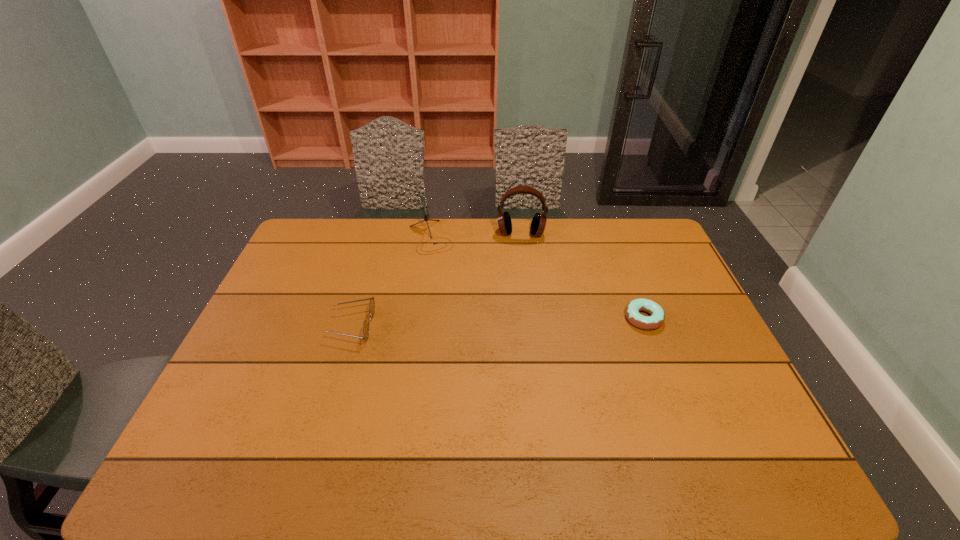
Locate an element on the screen. This screenshot has height=540, width=960. vacant space located 0.060m on the front-facing side of the third tallest object is located at coordinates [312, 326].

This screenshot has width=960, height=540. Find the location of `vacant space located on the back of the shortest object`. vacant space located on the back of the shortest object is located at coordinates click(x=618, y=253).

In order to click on vacant space located on the stand of the second tallest object in this screenshot , I will do `click(467, 316)`.

Where is `free space located 0.260m on the stand of the second tallest object`? The image size is (960, 540). free space located 0.260m on the stand of the second tallest object is located at coordinates (460, 303).

Locate an element on the screen. vacant area situated on the stand of the second tallest object is located at coordinates (460, 303).

Find the location of a particular element. This screenshot has width=960, height=540. free spot located 0.120m on the ear pads of the headset is located at coordinates (519, 262).

Locate an element on the screen. free region located 0.380m on the ear pads of the headset is located at coordinates (519, 317).

The height and width of the screenshot is (540, 960). In order to click on blank area located on the ear pads of the headset in this screenshot , I will do `click(519, 288)`.

Identify the location of microphone at the far edge. (423, 202).

Locate an element on the screen. The height and width of the screenshot is (540, 960). headset situated at the far edge is located at coordinates (538, 223).